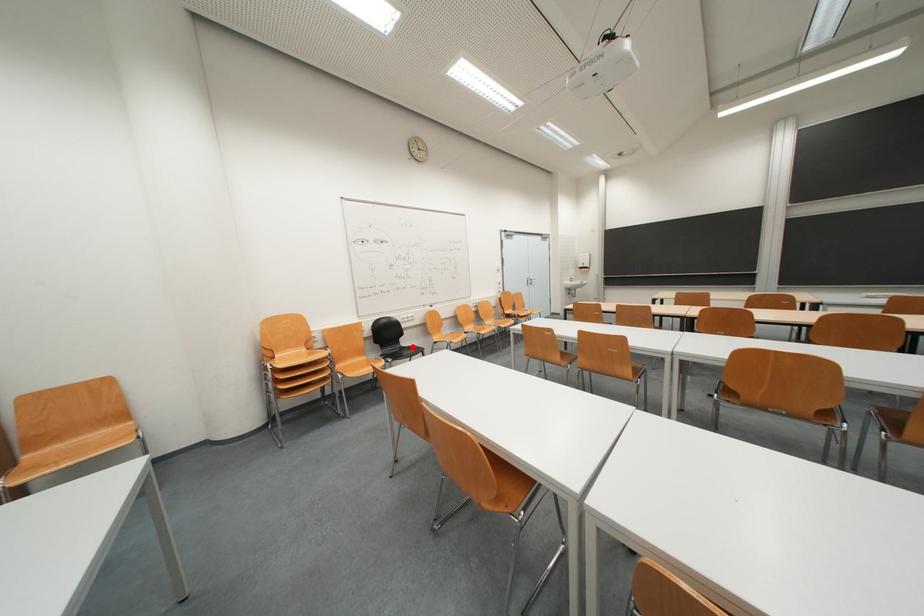
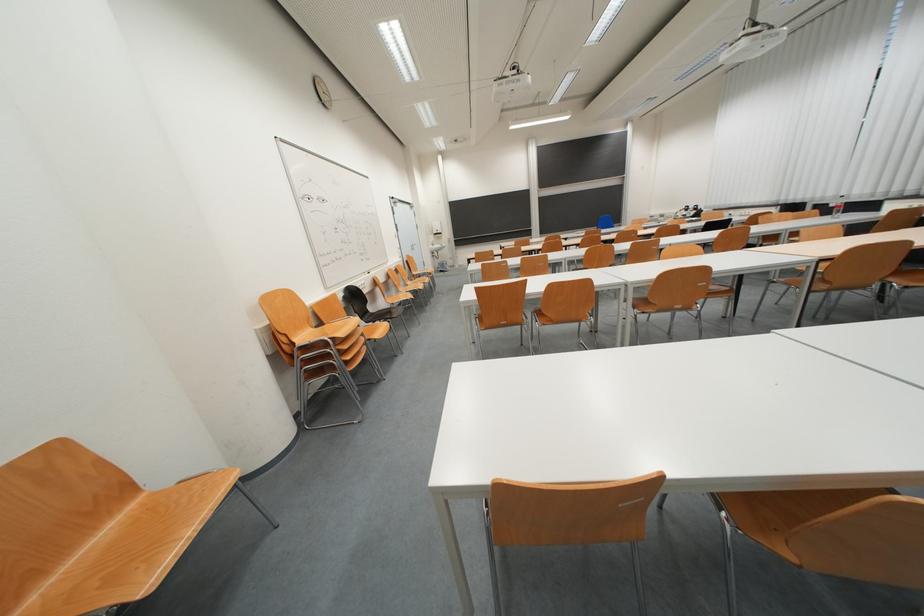
Question: I am providing you with two images of the same scene from different viewpoints. A red point is shown in image1. For the corresponding object point in image2, is it positioned nearer or farther from the camera?

Choices:
 (A) Nearer
 (B) Farther

Answer: (A)